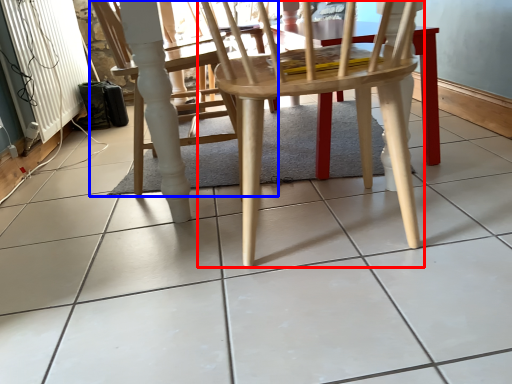
Question: Which object appears closest to the camera in this image, chair (highlighted by a red box) or chair (highlighted by a blue box)?

Choices:
 (A) chair
 (B) chair

Answer: (A)